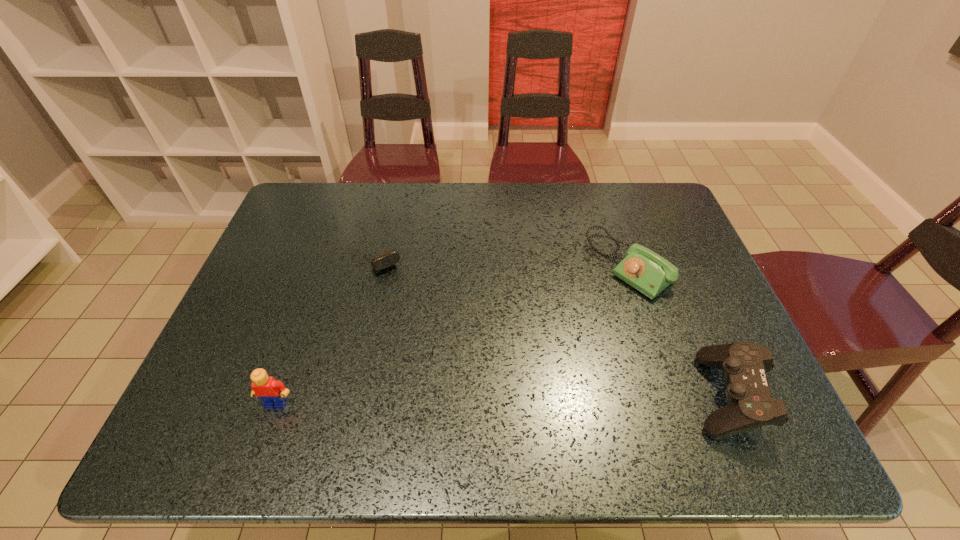
The image size is (960, 540). Find the location of `free spot located 0.390m on the dial of the third tallest object`. free spot located 0.390m on the dial of the third tallest object is located at coordinates (496, 372).

At what (x,y) coordinates should I click in order to perform the action: click on vacant region located 0.330m on the dial of the third tallest object. Please return your answer as a coordinate pair (x, y). Looking at the image, I should click on (516, 357).

Identify the location of vacant region located on the dial of the third tallest object. Image resolution: width=960 pixels, height=540 pixels. (496, 372).

Locate an element on the screen. The width and height of the screenshot is (960, 540). object that is positioned at the far edge is located at coordinates (387, 259).

At what (x,y) coordinates should I click in order to perform the action: click on Lego positioned at the near edge. Please return your answer as a coordinate pair (x, y). Looking at the image, I should click on (273, 393).

This screenshot has height=540, width=960. Find the location of `control situated at the near edge`. control situated at the near edge is located at coordinates (x=744, y=364).

The height and width of the screenshot is (540, 960). I want to click on object positioned at the left edge, so click(273, 393).

Locate an element on the screen. The width and height of the screenshot is (960, 540). control that is at the right edge is located at coordinates (744, 364).

Where is `telephone that is at the right edge`? The width and height of the screenshot is (960, 540). telephone that is at the right edge is located at coordinates (643, 269).

Locate an element on the screen. object situated at the near left corner is located at coordinates (273, 393).